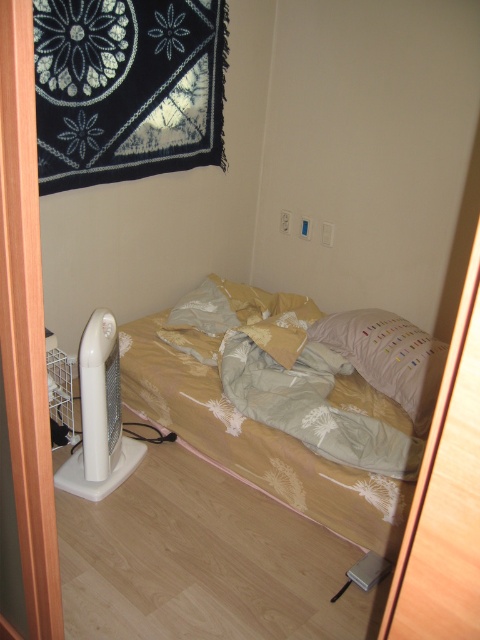
Can you confirm if light beige fabric bed at center is positioned to the right of light beige floral fabric at center?

Incorrect, light beige fabric bed at center is not on the right side of light beige floral fabric at center.

Where is `light beige fabric bed at center`? The image size is (480, 640). light beige fabric bed at center is located at coordinates (275, 417).

Is light beige fabric bed at center shorter than white soft pillow at upper right?

No, light beige fabric bed at center is not shorter than white soft pillow at upper right.

Can you confirm if light beige fabric bed at center is positioned above white soft pillow at upper right?

No.

Where is `light beige fabric bed at center`? light beige fabric bed at center is located at coordinates (275, 417).

Does light beige floral fabric at center have a lesser height compared to white plastic fan at lower left?

Yes.

Between light beige floral fabric at center and white plastic fan at lower left, which one is positioned lower?

Positioned lower is light beige floral fabric at center.

Identify the location of light beige floral fabric at center. The width and height of the screenshot is (480, 640). point(312,406).